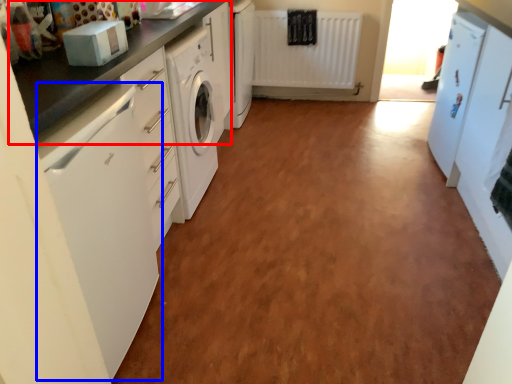
Question: Which object is closer to the camera taking this photo, countertop (highlighted by a red box) or home appliance (highlighted by a blue box)?

Choices:
 (A) countertop
 (B) home appliance

Answer: (B)